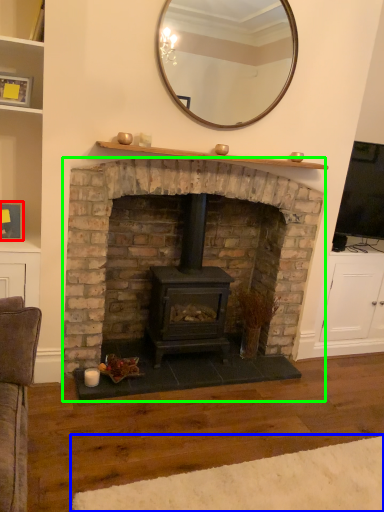
Question: Which object is the closest to the picture frame (highlighted by a red box)? Choose among these: plain (highlighted by a blue box) or fireplace (highlighted by a green box).

Choices:
 (A) plain
 (B) fireplace

Answer: (B)